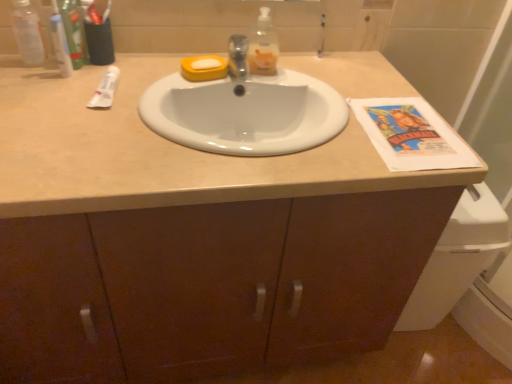
Question: Are white glossy sink at center and green plastic toothpaste tube at upper left, which ranks as the first toiletry in left-to-right order, far apart?

Choices:
 (A) no
 (B) yes

Answer: (A)

Question: Is white glossy sink at center outside green plastic toothpaste tube at upper left, placed as the 2th toiletry when sorted from right to left?

Choices:
 (A) yes
 (B) no

Answer: (A)

Question: From a real-world perspective, is white glossy sink at center physically above green plastic toothpaste tube at upper left, which ranks as the first toiletry in left-to-right order?

Choices:
 (A) yes
 (B) no

Answer: (B)

Question: Does white glossy sink at center turn towards green plastic toothpaste tube at upper left, placed as the 2th toiletry when sorted from right to left?

Choices:
 (A) no
 (B) yes

Answer: (A)

Question: Is the depth of white glossy sink at center less than that of green plastic toothpaste tube at upper left, which ranks as the first toiletry in left-to-right order?

Choices:
 (A) no
 (B) yes

Answer: (B)

Question: From the image's perspective, does white glossy sink at center appear higher than green plastic toothpaste tube at upper left, placed as the 2th toiletry when sorted from right to left?

Choices:
 (A) no
 (B) yes

Answer: (A)

Question: Is white glossy sink at center completely or partially inside translucent plastic soap dispenser at upper center, placed as the first bottle when sorted from right to left?

Choices:
 (A) yes
 (B) no

Answer: (B)

Question: Can we say translucent plastic soap dispenser at upper center, the second bottle in the left-to-right sequence, lies outside white glossy sink at center?

Choices:
 (A) no
 (B) yes

Answer: (B)

Question: Is translucent plastic soap dispenser at upper center, the second bottle in the left-to-right sequence, taller than white glossy sink at center?

Choices:
 (A) no
 (B) yes

Answer: (B)

Question: From a real-world perspective, is translucent plastic soap dispenser at upper center, the second bottle in the left-to-right sequence, on top of white glossy sink at center?

Choices:
 (A) yes
 (B) no

Answer: (A)

Question: Does translucent plastic soap dispenser at upper center, the second bottle in the left-to-right sequence, come in front of white glossy sink at center?

Choices:
 (A) yes
 (B) no

Answer: (B)

Question: Is translucent plastic soap dispenser at upper center, the second bottle in the left-to-right sequence, oriented away from white glossy sink at center?

Choices:
 (A) no
 (B) yes

Answer: (A)

Question: Does green plastic toothpaste tube at upper left, placed as the 2th toiletry when sorted from right to left, have a larger size compared to white glossy sink at center?

Choices:
 (A) no
 (B) yes

Answer: (A)